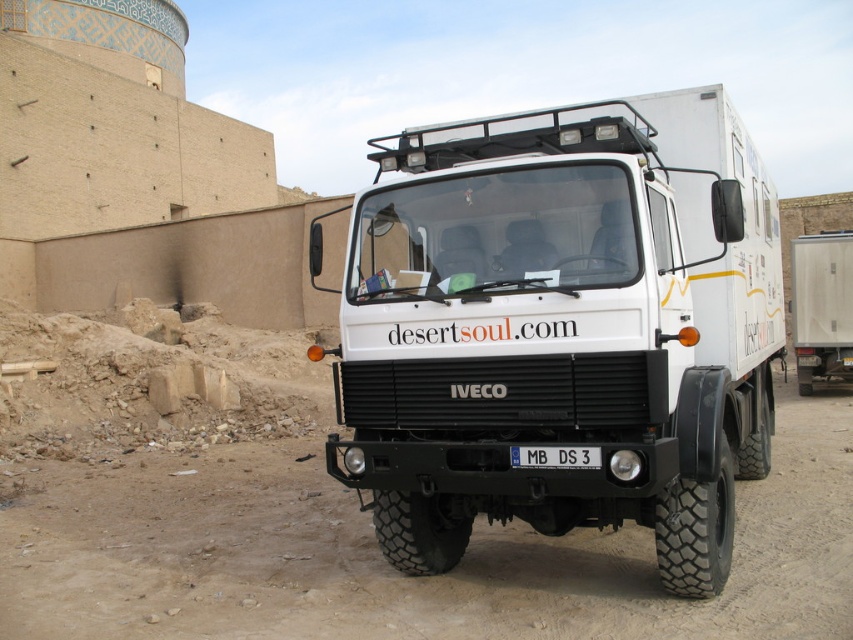
Question: Can you confirm if white matte truck at center is positioned above white matte trailer at right?

Choices:
 (A) yes
 (B) no

Answer: (A)

Question: Which of these objects is positioned farthest from the white plastic license plate at center?

Choices:
 (A) white matte trailer at right
 (B) white matte truck at center

Answer: (A)

Question: Which object is farther from the camera taking this photo?

Choices:
 (A) brown sandy dirt track at center
 (B) white matte truck at center

Answer: (A)

Question: Is white matte trailer at right thinner than white plastic license plate at center?

Choices:
 (A) no
 (B) yes

Answer: (A)

Question: Does white matte truck at center appear on the left side of brown sandy dirt track at center?

Choices:
 (A) no
 (B) yes

Answer: (A)

Question: Estimate the real-world distances between objects in this image. Which object is farther from the white plastic license plate at center?

Choices:
 (A) white matte truck at center
 (B) brown sandy dirt track at center

Answer: (B)